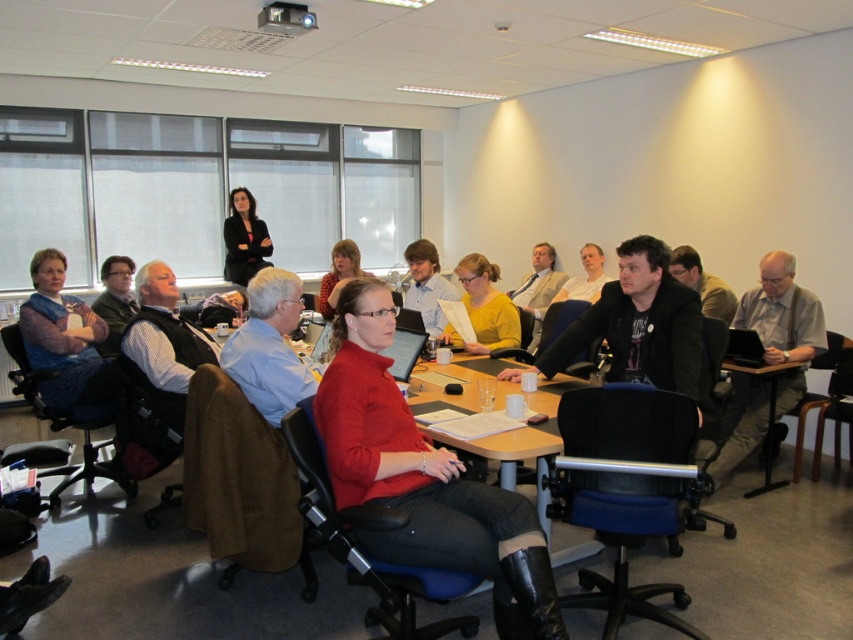
You are a photographer in the back of the room and want to take a photo of both the light blue shirt at center and the light brown leather jacket at center without any obstruction. Based on their heights, which object should you focus on first to ensure both are visible?

The light blue shirt at center is not as tall as the light brown leather jacket at center, so you should focus on the light brown leather jacket at center first to ensure both are visible.